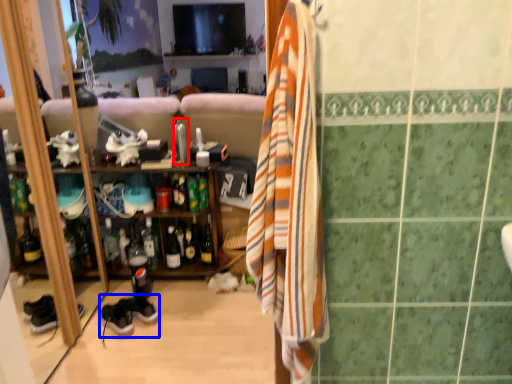
Question: Which object is closer to the camera taking this photo, faucet (highlighted by a red box) or shoe (highlighted by a blue box)?

Choices:
 (A) faucet
 (B) shoe

Answer: (B)